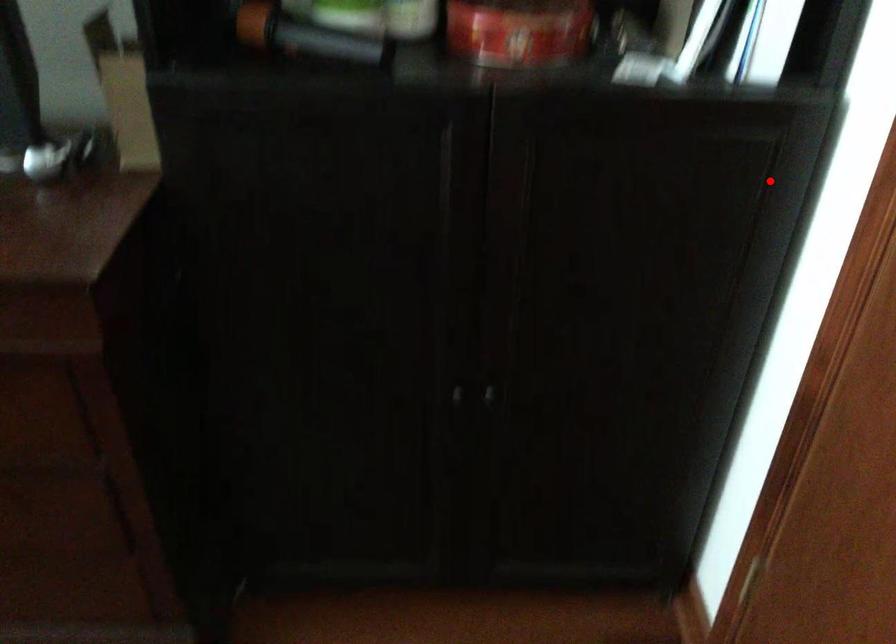
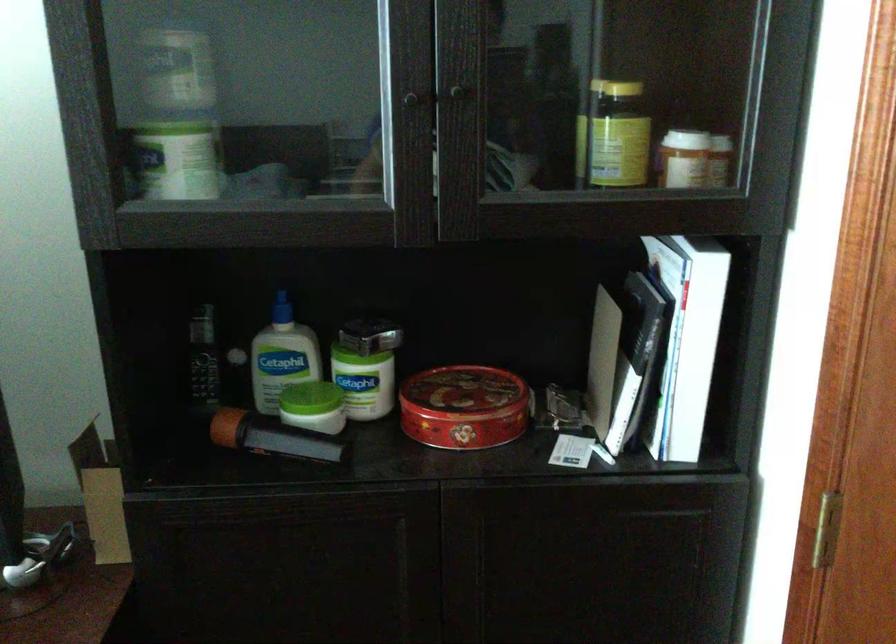
Locate, in the second image, the point that corresponds to the highlighted location in the first image.

(707, 554)